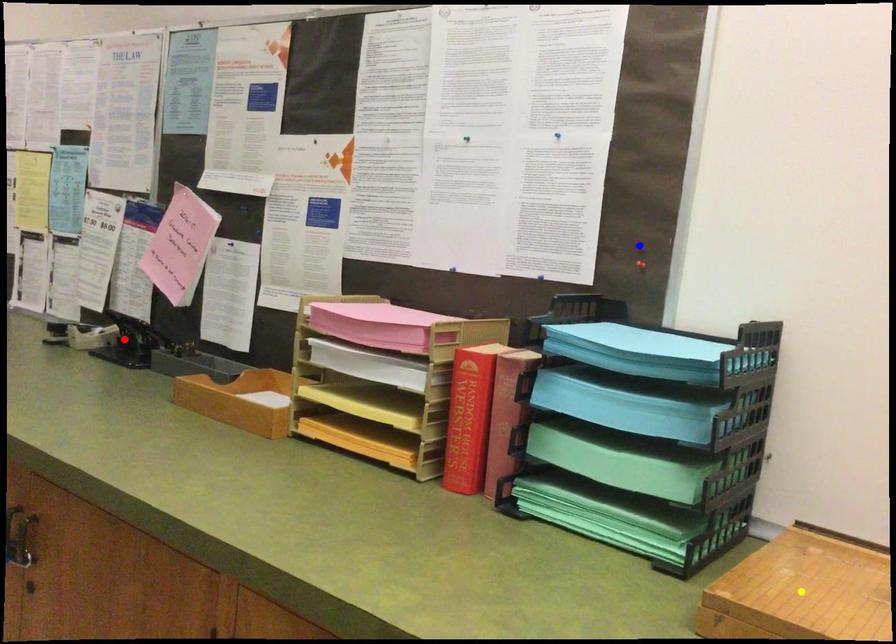
Order these from nearest to farthest:
yellow point, red point, blue point

1. yellow point
2. blue point
3. red point